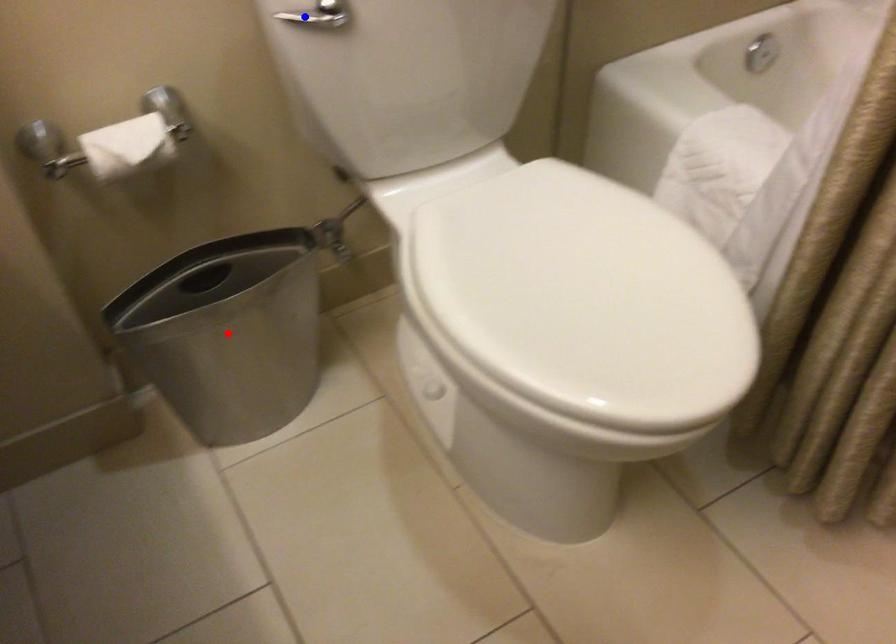
Question: In the image, two points are highlighted. Which point is nearer to the camera? Reply with the corresponding letter.

Choices:
 (A) blue point
 (B) red point

Answer: (A)